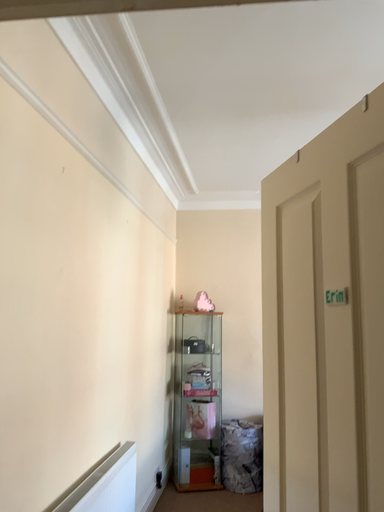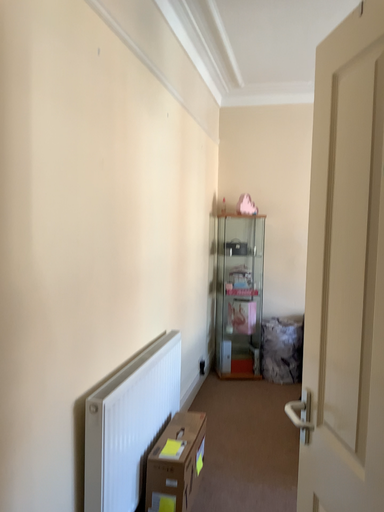
Question: Which way did the camera rotate in the video?

Choices:
 (A) rotated downward
 (B) rotated upward

Answer: (A)